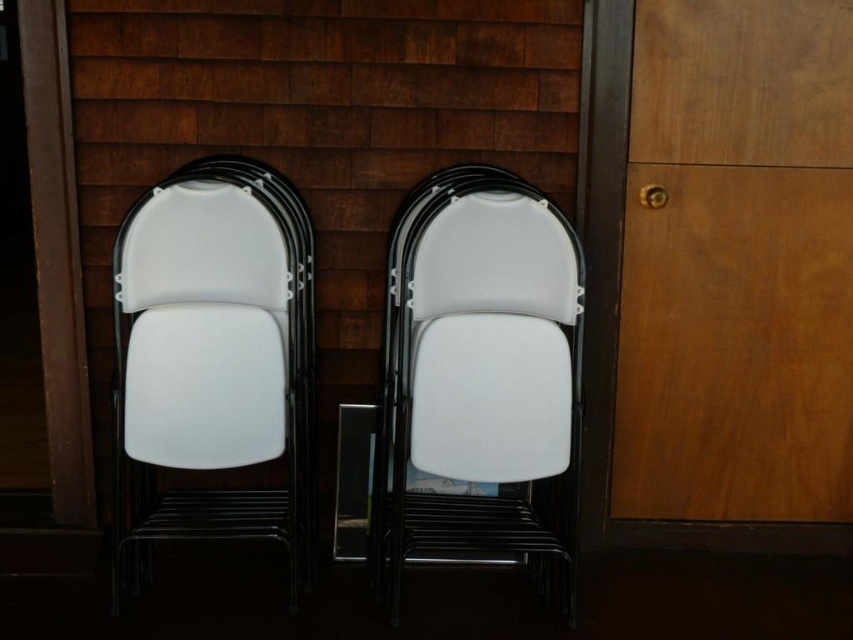
Question: In this image, where is white plastic chair at center located relative to white plastic chair at left?

Choices:
 (A) left
 (B) right

Answer: (B)

Question: From the image, what is the correct spatial relationship of white plastic chair at center in relation to white plastic chair at left?

Choices:
 (A) above
 (B) below

Answer: (B)

Question: Can you confirm if white plastic chair at center is positioned below white plastic chair at left?

Choices:
 (A) yes
 (B) no

Answer: (A)

Question: Which object is closer to the camera taking this photo?

Choices:
 (A) white plastic chair at left
 (B) white plastic chair at center

Answer: (A)